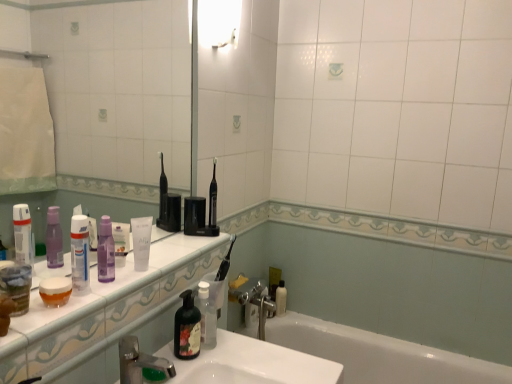
The height and width of the screenshot is (384, 512). Find the location of `vacant area to the right of purple translucent mouthwash at center, the 2th mouthwash ordered from the bottom`. vacant area to the right of purple translucent mouthwash at center, the 2th mouthwash ordered from the bottom is located at coordinates (158, 266).